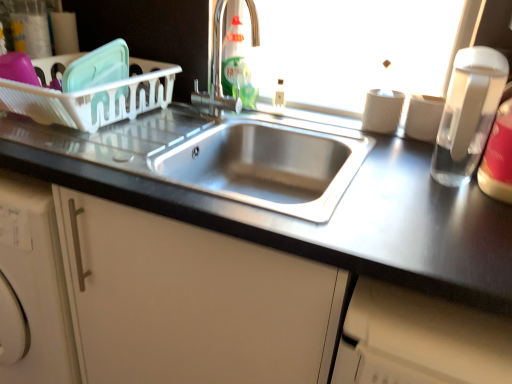
At what (x,y) coordinates should I click in order to perform the action: click on vacant space to the left of clear glass water bottle at right. Please return your answer as a coordinate pair (x, y). The width and height of the screenshot is (512, 384). Looking at the image, I should click on (397, 176).